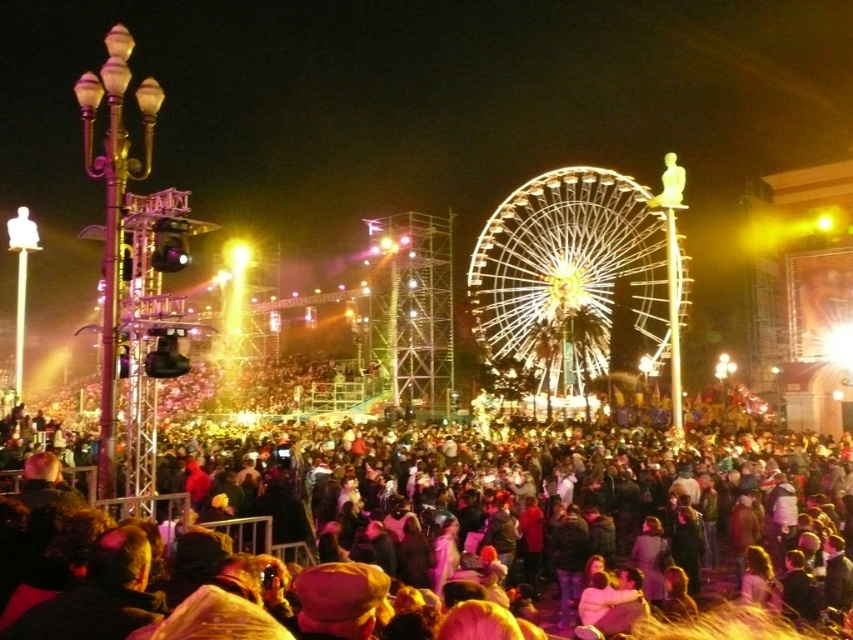
Question: Is dark brown fabric crowd at center smaller than illuminated steel ferris wheel at center?

Choices:
 (A) no
 (B) yes

Answer: (A)

Question: Which object is closer to the camera taking this photo?

Choices:
 (A) illuminated steel ferris wheel at center
 (B) dark brown fabric crowd at center

Answer: (B)

Question: Can you confirm if dark brown fabric crowd at center is smaller than illuminated steel ferris wheel at center?

Choices:
 (A) yes
 (B) no

Answer: (B)

Question: Does dark brown fabric crowd at center have a lesser width compared to illuminated steel ferris wheel at center?

Choices:
 (A) yes
 (B) no

Answer: (B)